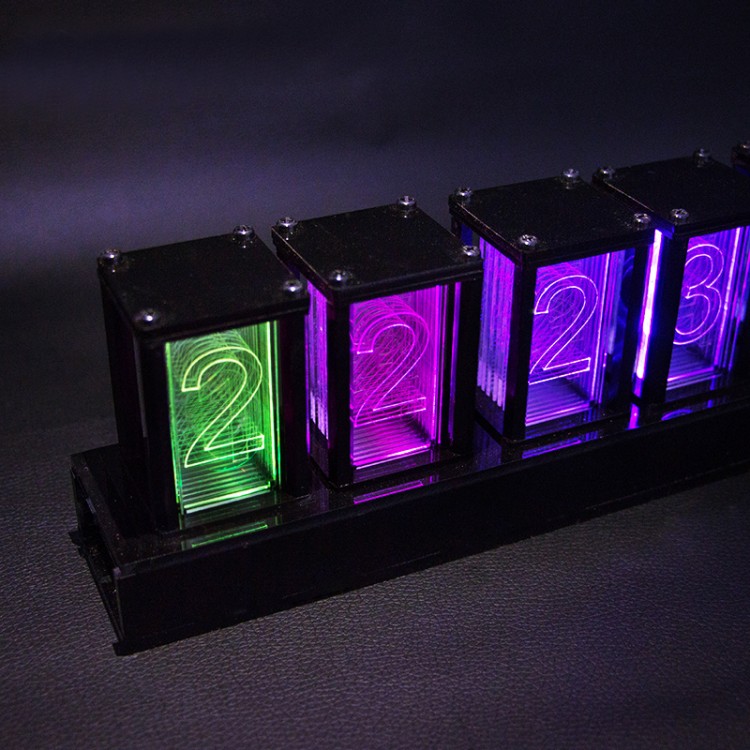
The image size is (750, 750). What are the coordinates of `green light` in the screenshot? It's located at (211, 409).